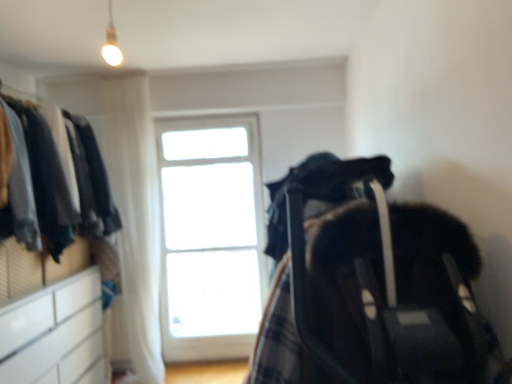
Question: Does white sheer curtain at upper left have a greater height compared to white glossy dresser at left?

Choices:
 (A) no
 (B) yes

Answer: (B)

Question: From the image's perspective, is white sheer curtain at upper left below white glossy dresser at left?

Choices:
 (A) yes
 (B) no

Answer: (A)

Question: From a real-world perspective, is white sheer curtain at upper left on white glossy dresser at left?

Choices:
 (A) yes
 (B) no

Answer: (B)

Question: Considering the relative sizes of white sheer curtain at upper left and white glossy dresser at left in the image provided, is white sheer curtain at upper left shorter than white glossy dresser at left?

Choices:
 (A) no
 (B) yes

Answer: (A)

Question: Is white sheer curtain at upper left oriented away from white glossy dresser at left?

Choices:
 (A) yes
 (B) no

Answer: (B)

Question: Does white sheer curtain at upper left have a lesser width compared to white glossy dresser at left?

Choices:
 (A) yes
 (B) no

Answer: (A)

Question: From a real-world perspective, is dark fabric baby carriage at right under white sheer curtain at upper left?

Choices:
 (A) yes
 (B) no

Answer: (A)

Question: Is dark fabric baby carriage at right facing towards white sheer curtain at upper left?

Choices:
 (A) yes
 (B) no

Answer: (B)

Question: Can you confirm if dark fabric baby carriage at right is bigger than white sheer curtain at upper left?

Choices:
 (A) no
 (B) yes

Answer: (B)

Question: Does dark fabric baby carriage at right have a greater width compared to white sheer curtain at upper left?

Choices:
 (A) yes
 (B) no

Answer: (A)

Question: Can you confirm if dark fabric baby carriage at right is positioned to the right of white sheer curtain at upper left?

Choices:
 (A) no
 (B) yes

Answer: (B)

Question: From the image's perspective, is dark fabric baby carriage at right on white sheer curtain at upper left?

Choices:
 (A) yes
 (B) no

Answer: (B)

Question: From the image's perspective, does white glossy dresser at left appear higher than white glass window at center?

Choices:
 (A) no
 (B) yes

Answer: (B)